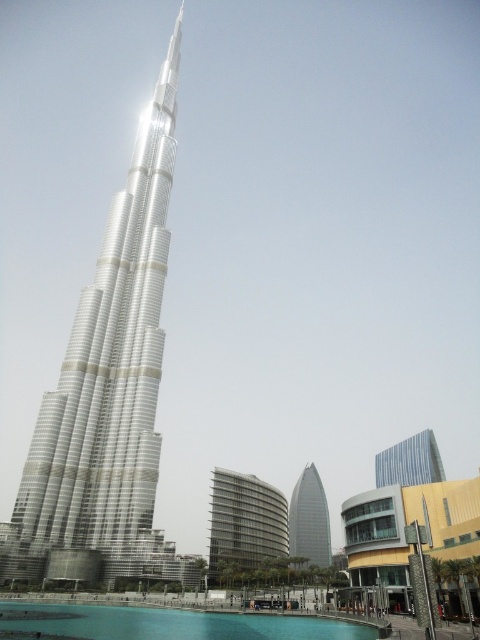
Question: Is metallic glass building at center above glassy silver tower at center?

Choices:
 (A) no
 (B) yes

Answer: (B)

Question: Among these objects, which one is farthest from the camera?

Choices:
 (A) metallic glass building at center
 (B) green glass pool at lower center

Answer: (A)

Question: Is shiny glass tower at center bigger than glassy silver tower at center?

Choices:
 (A) yes
 (B) no

Answer: (A)

Question: Considering the real-world distances, which object is farthest from the shiny glass tower at center?

Choices:
 (A) metallic glass building at center
 (B) green glass pool at lower center
 (C) metallic glass tower at center

Answer: (C)

Question: Among these points, which one is farthest from the camera?

Choices:
 (A) (88, 305)
 (B) (320, 497)
 (C) (386, 472)
 (D) (240, 477)

Answer: (B)

Question: Where is shiny glass tower at center located in relation to glassy silver tower at center in the image?

Choices:
 (A) right
 (B) left

Answer: (B)